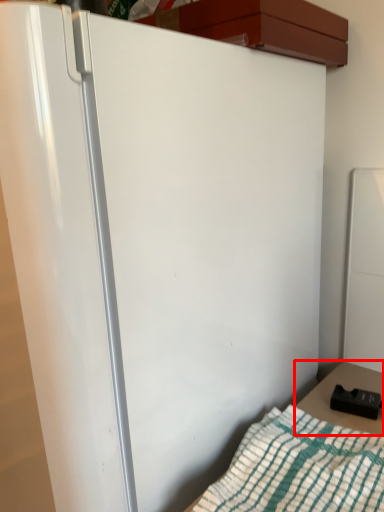
Question: From the image's perspective, what is the correct spatial positioning of table (annotated by the red box) in reference to blanket?

Choices:
 (A) above
 (B) below

Answer: (A)